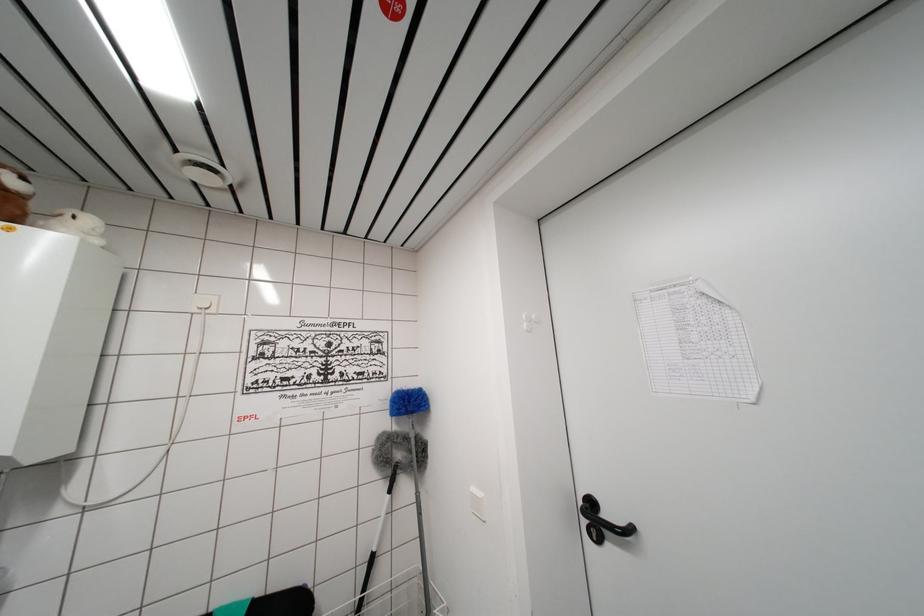
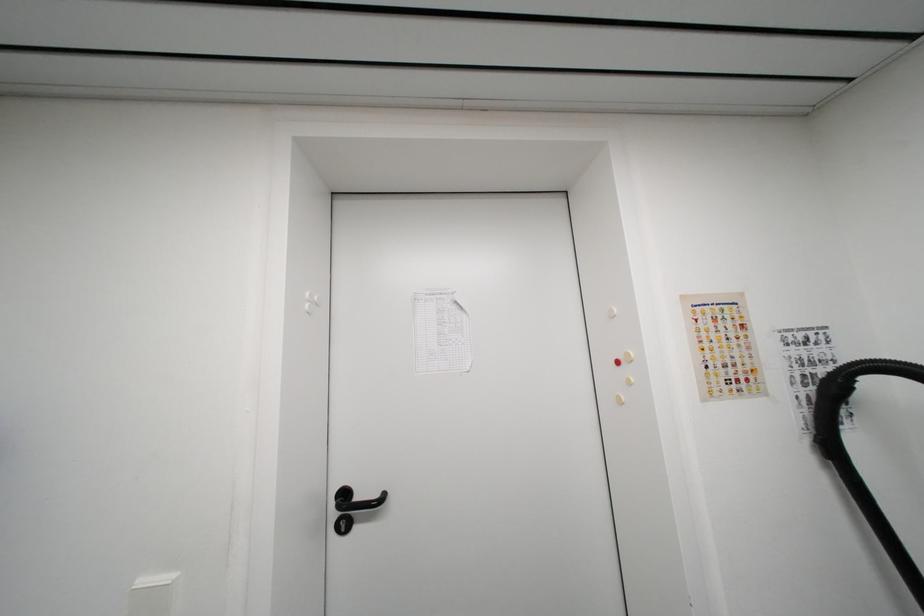
Question: The images are taken continuously from a first-person perspective. In which direction is your viewpoint rotating?

Choices:
 (A) Left
 (B) Right
 (C) Up
 (D) Down

Answer: (B)